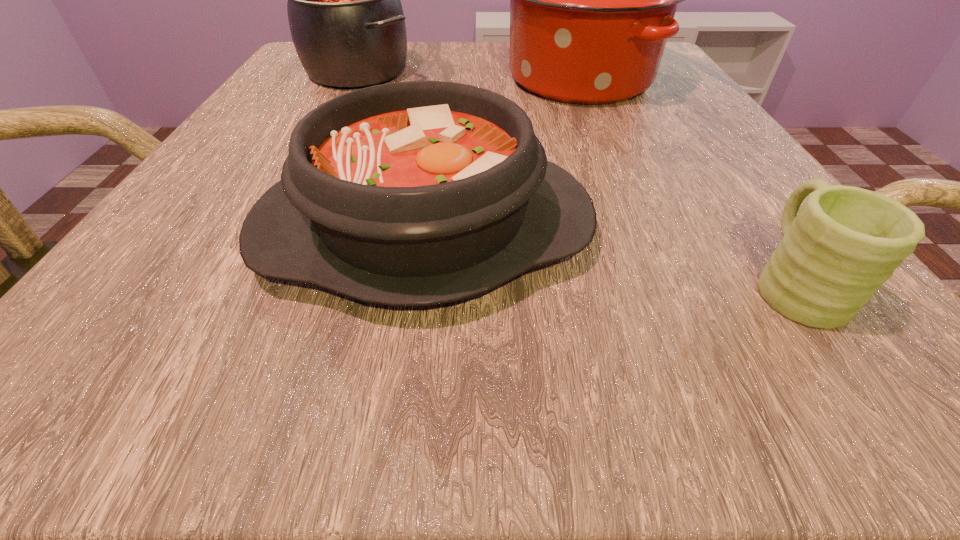
Locate an element on the screen. casserole located at the right edge is located at coordinates (592, 0).

I want to click on mug that is at the right edge, so click(x=845, y=242).

Locate an element on the screen. Image resolution: width=960 pixels, height=540 pixels. object situated at the far left corner is located at coordinates (346, 19).

The width and height of the screenshot is (960, 540). What are the coordinates of `object present at the near left corner` in the screenshot? It's located at (416, 193).

This screenshot has height=540, width=960. Find the location of `object that is positioned at the far right corner`. object that is positioned at the far right corner is located at coordinates (592, 0).

Where is `object at the near right corner`? Image resolution: width=960 pixels, height=540 pixels. object at the near right corner is located at coordinates (845, 242).

Where is `vacant space at the far edge of the desktop`? This screenshot has width=960, height=540. vacant space at the far edge of the desktop is located at coordinates (479, 64).

At what (x,y) coordinates should I click in order to perform the action: click on free location at the near edge. Please return your answer as a coordinate pair (x, y). The width and height of the screenshot is (960, 540). Looking at the image, I should click on (673, 370).

In the image, there is a desktop. Identify the location of vacant area at the left edge. (240, 161).

In the image, there is a desktop. Where is `vacant space at the right edge`? Image resolution: width=960 pixels, height=540 pixels. vacant space at the right edge is located at coordinates (656, 144).